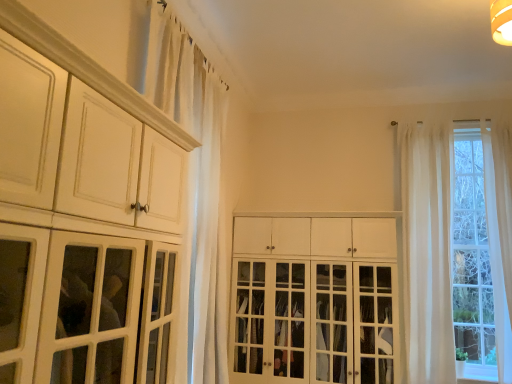
Question: Considering the relative sizes of white sheer curtain at upper left and white wood cabinet at center, placed as the first cabinetry when sorted from right to left, in the image provided, is white sheer curtain at upper left shorter than white wood cabinet at center, placed as the first cabinetry when sorted from right to left,?

Choices:
 (A) no
 (B) yes

Answer: (A)

Question: Is white sheer curtain at upper left positioned behind white wood cabinet at center, marked as the second cabinetry in a front-to-back arrangement?

Choices:
 (A) yes
 (B) no

Answer: (B)

Question: Considering the relative sizes of white sheer curtain at upper left and white wood cabinet at center, the 2th cabinetry from the left, in the image provided, is white sheer curtain at upper left taller than white wood cabinet at center, the 2th cabinetry from the left,?

Choices:
 (A) no
 (B) yes

Answer: (B)

Question: Does white sheer curtain at upper left have a greater width compared to white wood cabinet at center, placed as the first cabinetry when sorted from right to left?

Choices:
 (A) yes
 (B) no

Answer: (B)

Question: Is white sheer curtain at upper left facing away from white wood cabinet at center, the 2th cabinetry from the left?

Choices:
 (A) yes
 (B) no

Answer: (B)

Question: Based on their positions, is sheer white curtains at right located to the left or right of white wood cabinet at center, placed as the first cabinetry when sorted from right to left?

Choices:
 (A) left
 (B) right

Answer: (B)

Question: From a real-world perspective, is sheer white curtains at right positioned above or below white wood cabinet at center, the 2th cabinetry from the left?

Choices:
 (A) above
 (B) below

Answer: (A)

Question: In terms of width, does sheer white curtains at right look wider or thinner when compared to white wood cabinet at center, the first cabinetry viewed from the back?

Choices:
 (A) wide
 (B) thin

Answer: (B)

Question: Do you think sheer white curtains at right is within white wood cabinet at center, the first cabinetry viewed from the back, or outside of it?

Choices:
 (A) outside
 (B) inside

Answer: (A)

Question: From the image's perspective, relative to white sheer curtain at upper left, is white wood cabinet at center, marked as the second cabinetry in a front-to-back arrangement, above or below?

Choices:
 (A) above
 (B) below

Answer: (B)

Question: In terms of height, does white wood cabinet at center, the first cabinetry viewed from the back, look taller or shorter compared to white sheer curtain at upper left?

Choices:
 (A) short
 (B) tall

Answer: (A)

Question: Does point (365, 276) appear closer or farther from the camera than point (170, 79)?

Choices:
 (A) closer
 (B) farther

Answer: (B)

Question: Considering the positions of white wood cabinet at center, the first cabinetry viewed from the back, and white sheer curtain at upper left in the image, is white wood cabinet at center, the first cabinetry viewed from the back, bigger or smaller than white sheer curtain at upper left?

Choices:
 (A) big
 (B) small

Answer: (A)

Question: Is matte white cabinet at left, the first cabinetry from the front, in front of or behind white sheer curtain at upper left in the image?

Choices:
 (A) behind
 (B) front

Answer: (B)

Question: Which is correct: matte white cabinet at left, the 1th cabinetry positioned from the left, is inside white sheer curtain at upper left, or outside of it?

Choices:
 (A) inside
 (B) outside

Answer: (B)